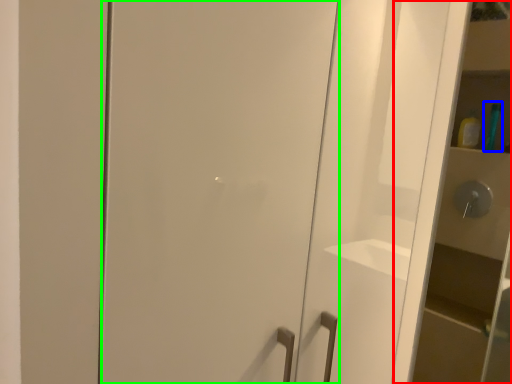
Question: Estimate the real-world distances between objects in this image. Which object is farther from cabinetry (highlighted by a red box), toiletry (highlighted by a blue box) or door (highlighted by a green box)?

Choices:
 (A) toiletry
 (B) door

Answer: (B)